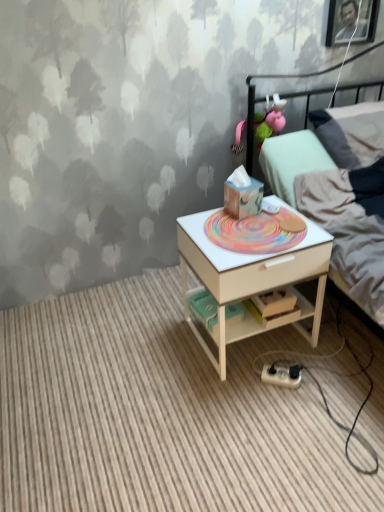
Question: Is light gray fabric bed at upper right turned away from pink fabric toy at upper center?

Choices:
 (A) no
 (B) yes

Answer: (B)

Question: From the image's perspective, is light gray fabric bed at upper right located beneath pink fabric toy at upper center?

Choices:
 (A) yes
 (B) no

Answer: (A)

Question: Is light gray fabric bed at upper right located outside pink fabric toy at upper center?

Choices:
 (A) no
 (B) yes

Answer: (B)

Question: Can you confirm if light gray fabric bed at upper right is shorter than pink fabric toy at upper center?

Choices:
 (A) yes
 (B) no

Answer: (B)

Question: Can you confirm if light gray fabric bed at upper right is smaller than pink fabric toy at upper center?

Choices:
 (A) yes
 (B) no

Answer: (B)

Question: Can you confirm if light gray fabric bed at upper right is wider than pink fabric toy at upper center?

Choices:
 (A) yes
 (B) no

Answer: (A)

Question: Is the depth of white wood nightstand at center less than that of white plastic power strip at lower center?

Choices:
 (A) no
 (B) yes

Answer: (B)

Question: Is white wood nightstand at center in contact with white plastic power strip at lower center?

Choices:
 (A) no
 (B) yes

Answer: (A)

Question: Considering the relative positions of white wood nightstand at center and white plastic power strip at lower center in the image provided, is white wood nightstand at center to the left of white plastic power strip at lower center from the viewer's perspective?

Choices:
 (A) no
 (B) yes

Answer: (B)

Question: Is white wood nightstand at center turned away from white plastic power strip at lower center?

Choices:
 (A) no
 (B) yes

Answer: (A)

Question: Does white wood nightstand at center contain white plastic power strip at lower center?

Choices:
 (A) no
 (B) yes

Answer: (B)

Question: From a real-world perspective, is white wood nightstand at center below white plastic power strip at lower center?

Choices:
 (A) yes
 (B) no

Answer: (A)

Question: Is light gray fabric bed at upper right positioned far away from white wood desk at center?

Choices:
 (A) no
 (B) yes

Answer: (A)